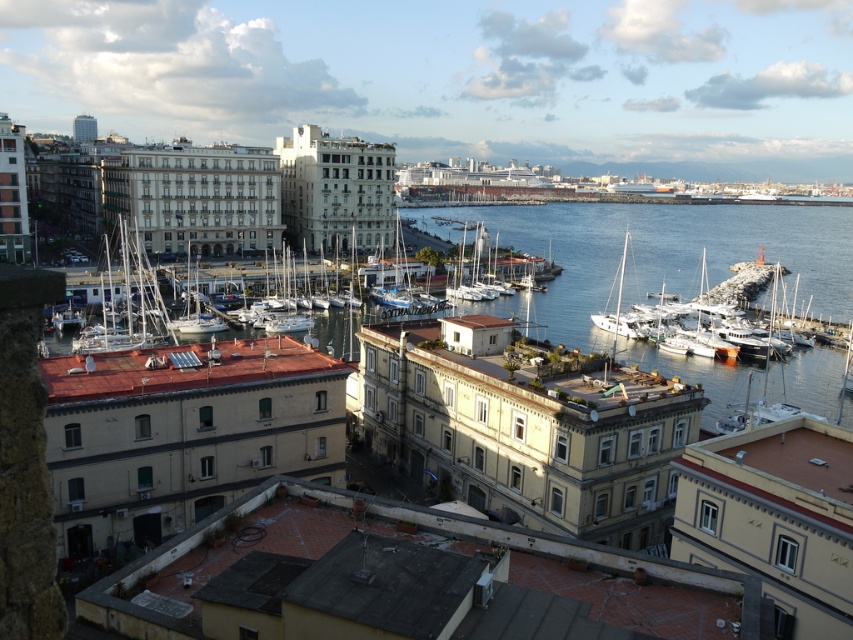
Question: Can you confirm if white glossy sailboat at center is smaller than white matte sailboat at center-left?

Choices:
 (A) no
 (B) yes

Answer: (A)

Question: Among these objects, which one is farthest from the camera?

Choices:
 (A) clear blue water at center
 (B) white matte boats at lower right

Answer: (B)

Question: Can you confirm if white matte sailboat at center is wider than white matte sailboat at center-left?

Choices:
 (A) yes
 (B) no

Answer: (A)

Question: Which object is closer to the camera taking this photo?

Choices:
 (A) clear blue water at center
 (B) white matte sailboat at center-left
 (C) white matte sailboat at center
 (D) white matte boats at lower right

Answer: (A)

Question: Can you confirm if white matte boats at lower right is smaller than white glossy sailboat at center?

Choices:
 (A) yes
 (B) no

Answer: (B)

Question: Which of these objects is positioned closest to the clear blue water at center?

Choices:
 (A) white matte boats at lower right
 (B) white matte sailboat at center-left

Answer: (A)